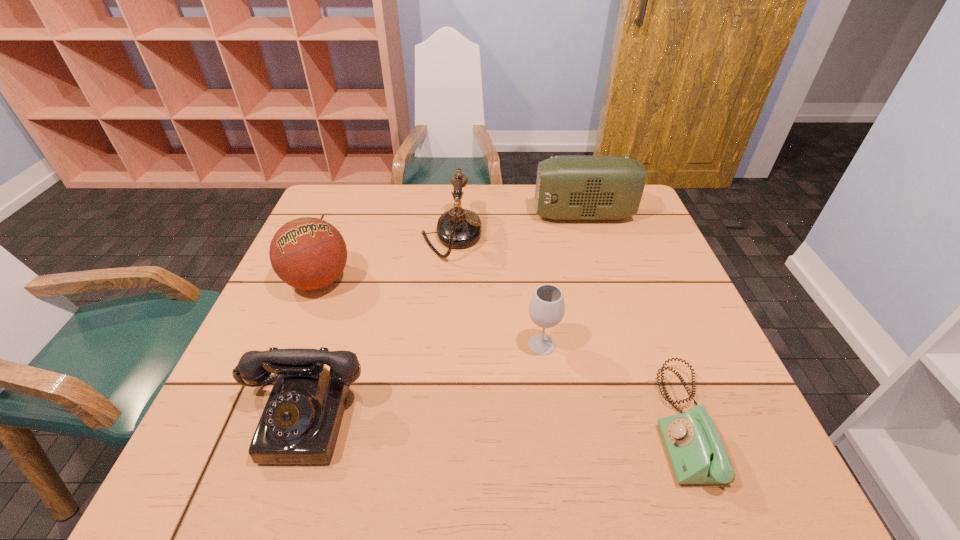
Image resolution: width=960 pixels, height=540 pixels. In the image, there is a desktop. In order to click on vacant space at the far left corner in this screenshot , I will do `click(350, 220)`.

Find the location of `free point between the basketball and the second telephone from right to left`. free point between the basketball and the second telephone from right to left is located at coordinates (385, 258).

Where is `vacant point located between the fourth farthest object and the leftmost telephone`? The image size is (960, 540). vacant point located between the fourth farthest object and the leftmost telephone is located at coordinates (421, 381).

Locate an element on the screen. free point between the leftmost telephone and the basketball is located at coordinates (310, 349).

At what (x,y) coordinates should I click in order to perform the action: click on unoccupied area between the leftmost telephone and the radio_receiver. Please return your answer as a coordinate pair (x, y). Looking at the image, I should click on [x=443, y=316].

Find the location of a particular element. vacant space that is in between the radio_receiver and the second telephone from left to right is located at coordinates (517, 225).

What are the coordinates of `vacant point located between the leftmost telephone and the basketball` in the screenshot? It's located at (310, 349).

Locate an element on the screen. The image size is (960, 540). vacant space that's between the rightmost telephone and the fourth farthest object is located at coordinates (612, 384).

What are the coordinates of `free space between the basketball and the shortest telephone` in the screenshot? It's located at (500, 352).

Locate an element on the screen. vacant space that's between the basketball and the shortest object is located at coordinates (500, 352).